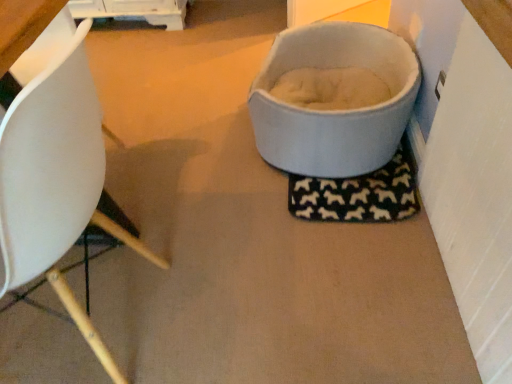
Question: Is light gray fabric pet bed at upper right closer to camera compared to white matte chair at left?

Choices:
 (A) yes
 (B) no

Answer: (B)

Question: Can you confirm if light gray fabric pet bed at upper right is taller than white matte chair at left?

Choices:
 (A) no
 (B) yes

Answer: (A)

Question: Can you confirm if light gray fabric pet bed at upper right is wider than white matte chair at left?

Choices:
 (A) yes
 (B) no

Answer: (A)

Question: Is light gray fabric pet bed at upper right at the left side of white matte chair at left?

Choices:
 (A) yes
 (B) no

Answer: (B)

Question: From the image's perspective, is light gray fabric pet bed at upper right located beneath white matte chair at left?

Choices:
 (A) yes
 (B) no

Answer: (B)

Question: Is light gray fabric pet bed at upper right positioned behind white matte chair at left?

Choices:
 (A) yes
 (B) no

Answer: (A)

Question: Considering the relative sizes of white matte chair at left and light gray fabric pet bed at upper right in the image provided, is white matte chair at left thinner than light gray fabric pet bed at upper right?

Choices:
 (A) no
 (B) yes

Answer: (B)

Question: Is white matte chair at left turned away from light gray fabric pet bed at upper right?

Choices:
 (A) yes
 (B) no

Answer: (B)

Question: From a real-world perspective, is white matte chair at left under light gray fabric pet bed at upper right?

Choices:
 (A) no
 (B) yes

Answer: (A)

Question: Is white matte chair at left further to camera compared to light gray fabric pet bed at upper right?

Choices:
 (A) no
 (B) yes

Answer: (A)

Question: Can you confirm if white matte chair at left is shorter than light gray fabric pet bed at upper right?

Choices:
 (A) yes
 (B) no

Answer: (B)

Question: Is white matte chair at left to the left of light gray fabric pet bed at upper right from the viewer's perspective?

Choices:
 (A) no
 (B) yes

Answer: (B)

Question: In the image, is light gray fabric pet bed at upper right positioned in front of or behind white matte chair at left?

Choices:
 (A) behind
 (B) front

Answer: (A)